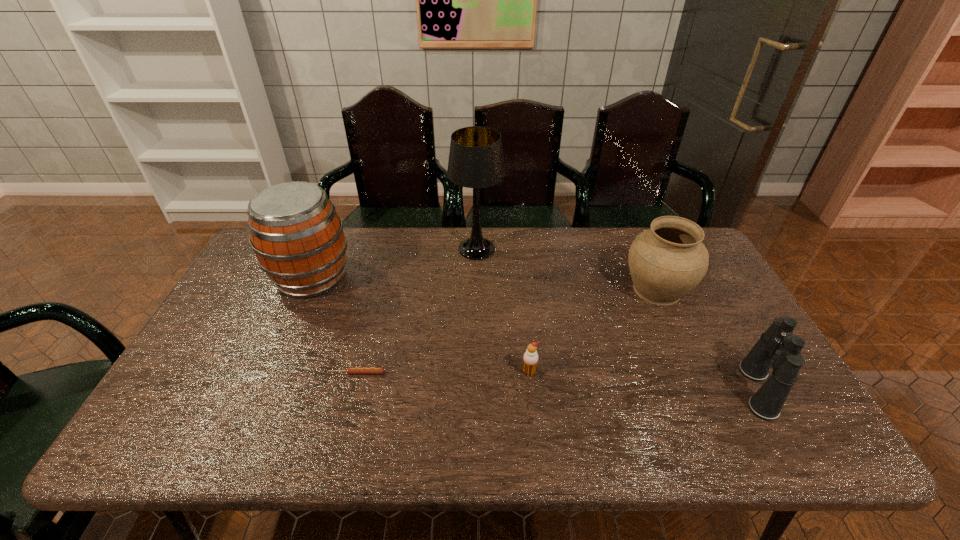
This screenshot has width=960, height=540. Find the location of `object located at the left edge`. object located at the left edge is located at coordinates (297, 236).

The width and height of the screenshot is (960, 540). Identify the location of urn located at the right edge. (667, 261).

In order to click on binoculars that is at the right edge in this screenshot , I will do `click(777, 348)`.

The width and height of the screenshot is (960, 540). I want to click on object situated at the far left corner, so click(x=297, y=236).

I want to click on object present at the far right corner, so click(x=667, y=261).

The image size is (960, 540). Find the location of `object located at the near right corner`. object located at the near right corner is located at coordinates click(777, 348).

Identify the location of vacant space at the far edge of the desktop. This screenshot has height=540, width=960. (566, 238).

Locate an element on the screen. Image resolution: width=960 pixels, height=540 pixels. vacant space at the left edge of the desktop is located at coordinates (234, 321).

In the image, there is a desktop. Where is `free region at the right edge`? The height and width of the screenshot is (540, 960). free region at the right edge is located at coordinates (698, 338).

The image size is (960, 540). Identify the location of vacant region between the sausage and the leftmost object. (x=334, y=325).